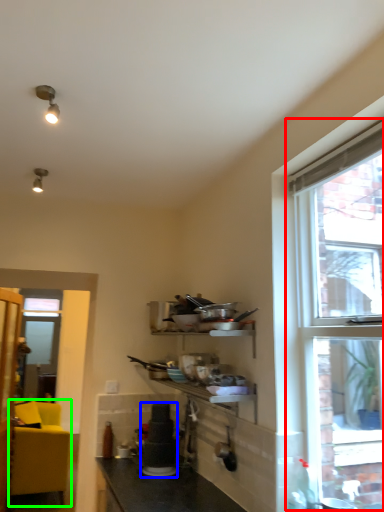
Question: Which object is positioned closest to window (highlighted by a red box)? Select from appliance (highlighted by a blue box) and studio couch (highlighted by a green box).

Choices:
 (A) appliance
 (B) studio couch

Answer: (A)